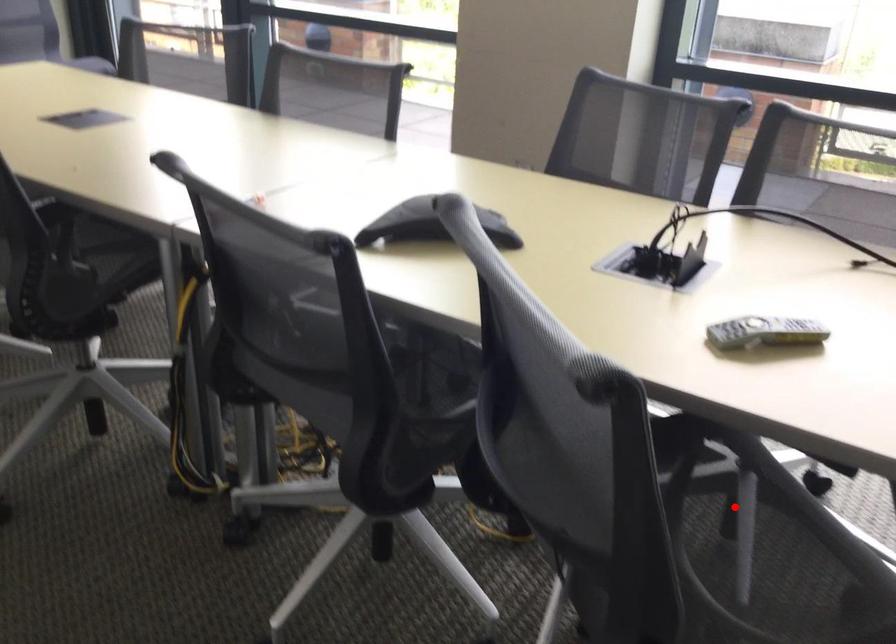
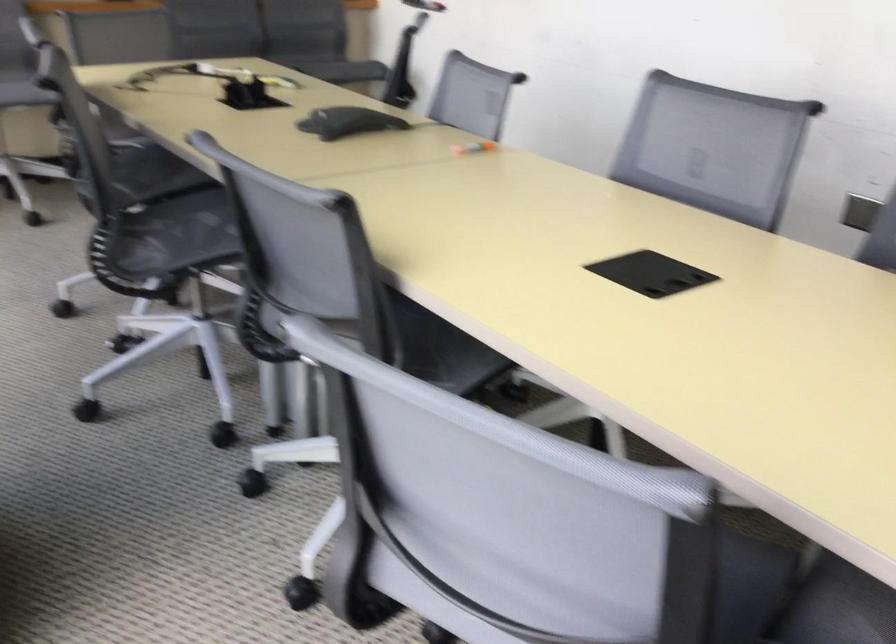
Question: I am providing you with two images of the same scene from different viewpoints. A red point is marked on the first image. Can you still see the location of the red point in image 2?

Choices:
 (A) Yes
 (B) No

Answer: (B)